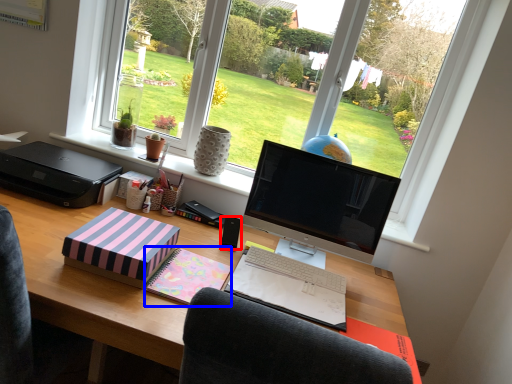
Question: Which object is closer to the camera taking this photo, speaker (highlighted by a red box) or paperback book (highlighted by a blue box)?

Choices:
 (A) speaker
 (B) paperback book

Answer: (B)